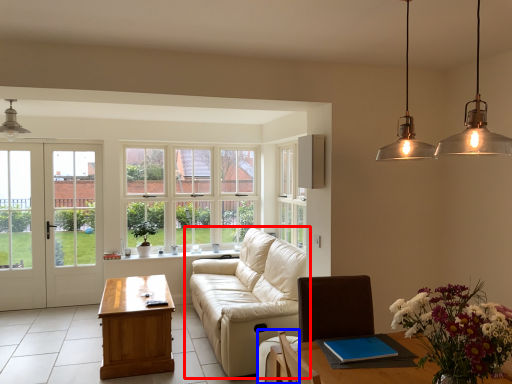
Question: Which of the following is the closest to the observer, studio couch (highlighted by a red box) or armchair (highlighted by a blue box)?

Choices:
 (A) studio couch
 (B) armchair

Answer: (B)